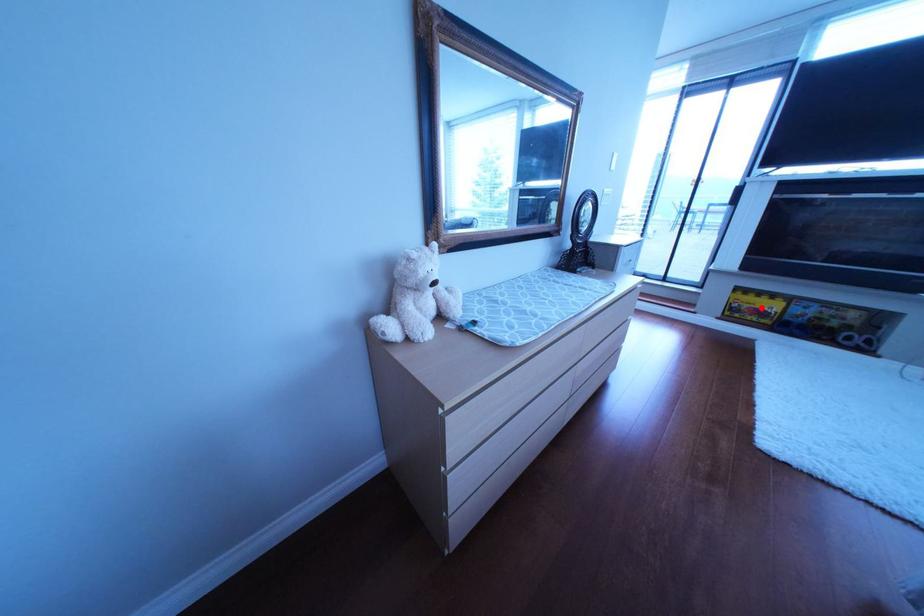
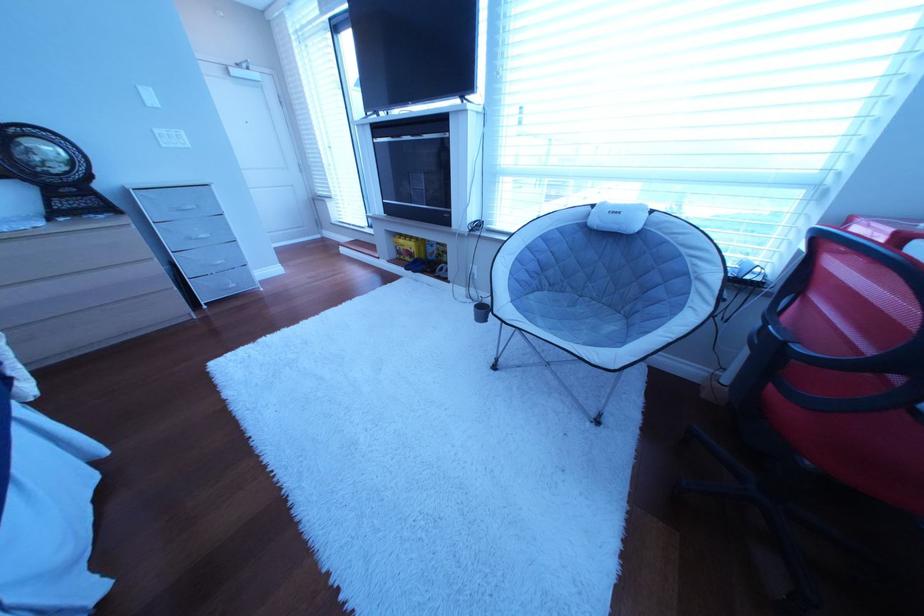
In the second image, find the point that corresponds to the highlighted location in the first image.

(418, 251)